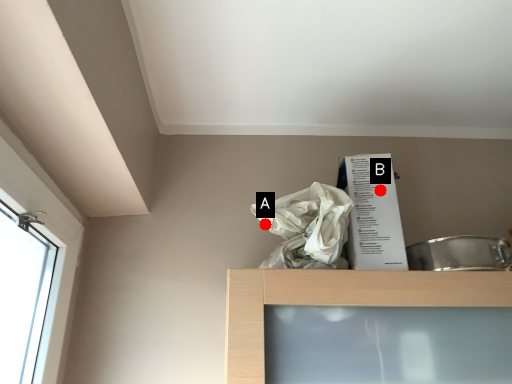
Question: Two points are circled on the image, labeled by A and B beside each circle. Which of the following is the farthest from the observer?

Choices:
 (A) A is further
 (B) B is further

Answer: (B)